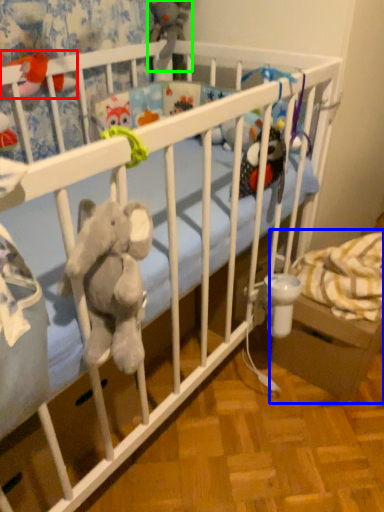
Question: Which object is positioned farthest from toy (highlighted by a red box)? Select from baby carriage (highlighted by a blue box) and toy (highlighted by a green box).

Choices:
 (A) baby carriage
 (B) toy

Answer: (A)